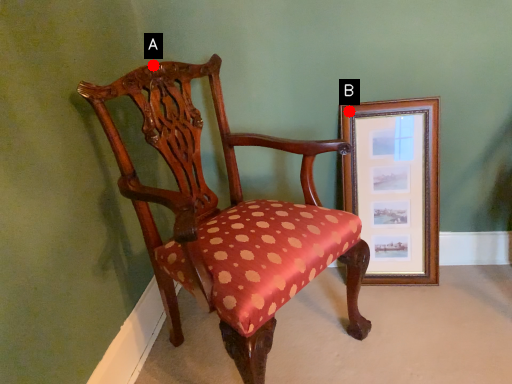
Question: Two points are circled on the image, labeled by A and B beside each circle. Which point is further to the camera?

Choices:
 (A) A is further
 (B) B is further

Answer: (B)